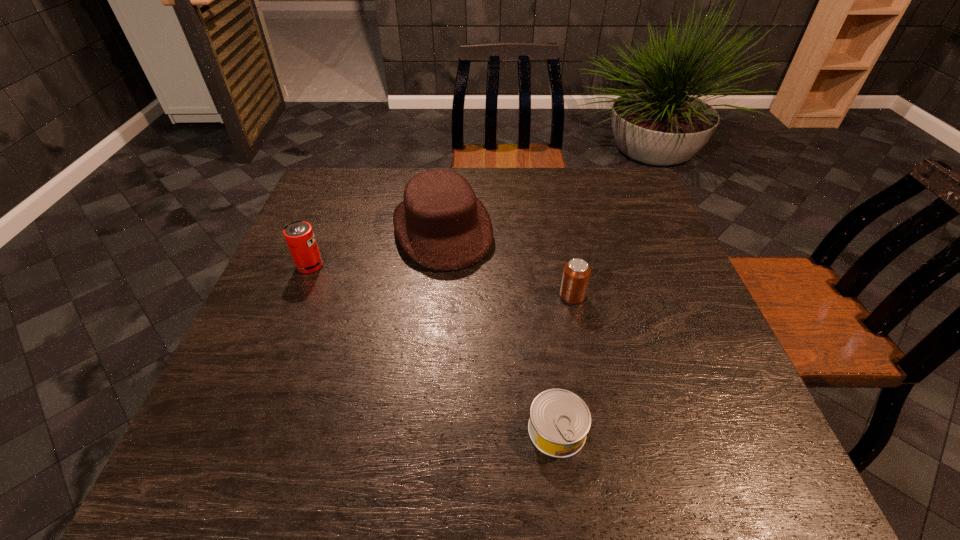
Locate an element on the screen. The height and width of the screenshot is (540, 960). vacant region between the second shortest can and the second object from left to right is located at coordinates (508, 262).

This screenshot has height=540, width=960. What are the coordinates of `free space between the third farthest object and the shortest object` in the screenshot? It's located at (564, 363).

Locate an element on the screen. unoccupied area between the nearest can and the second farthest can is located at coordinates (564, 363).

The height and width of the screenshot is (540, 960). In order to click on empty location between the tallest can and the nearest can in this screenshot , I will do point(434,348).

The width and height of the screenshot is (960, 540). In order to click on free spot between the tallest can and the third object from right to left in this screenshot , I will do [376, 247].

Locate an element on the screen. The height and width of the screenshot is (540, 960). vacant area between the third farthest object and the second object from left to right is located at coordinates (508, 262).

Find the location of a particular element. The image size is (960, 540). free spot between the leftmost object and the second shortest can is located at coordinates (x=441, y=281).

Identify the location of blank region between the second nearest object and the hat. Image resolution: width=960 pixels, height=540 pixels. (508, 262).

Find the location of a particular element. free space between the shortest can and the farthest can is located at coordinates (434, 348).

Image resolution: width=960 pixels, height=540 pixels. I want to click on unoccupied position between the hat and the nearest can, so click(500, 329).